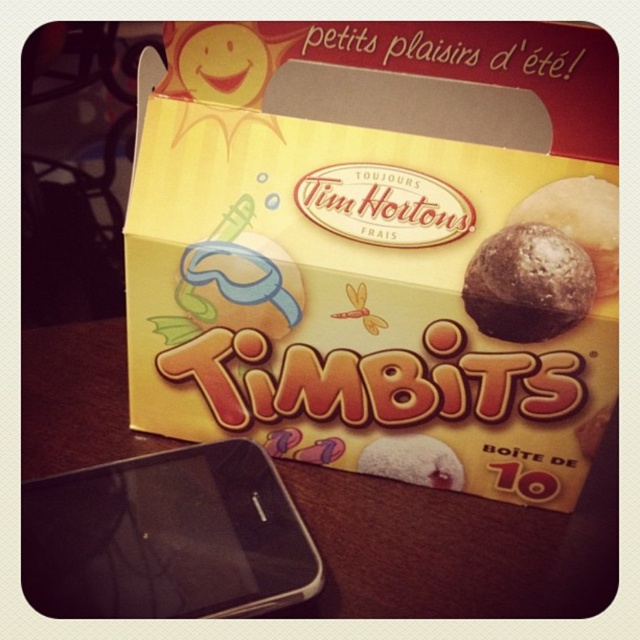
You are trying to determine which of the two points, point (604, 602) or point (77, 497), is closer to you in the image of the Tim Hortons Timbits box. Based on the scene description, which point is nearer?

Point (604, 602) is closer to the camera than point (77, 497), so it is the nearer one.

You are at a picnic and want to take a photo of the dark chocolate cookie at center. You have a black glossy smartphone at lower left. Can you place your phone closer to the cookie to get a better shot without moving the cookie?

The black glossy smartphone at lower left is located below the dark chocolate cookie at center, so you can move the phone upward toward the cookie to get closer without moving the cookie itself.

You are holding a 12 inch ruler and want to place it on the wooden table at center. Based on the distance provided, will the ruler fit entirely on the table?

The wooden table at center is 35.02 inches away from the viewer. The distance does not indicate the table size, so the ruler might fit, but we can not confirm based on the given information.